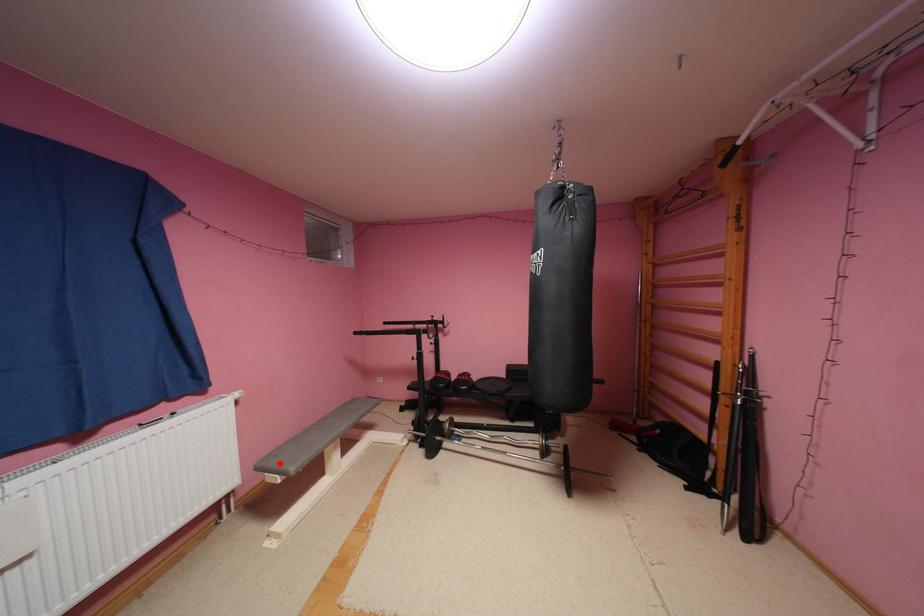
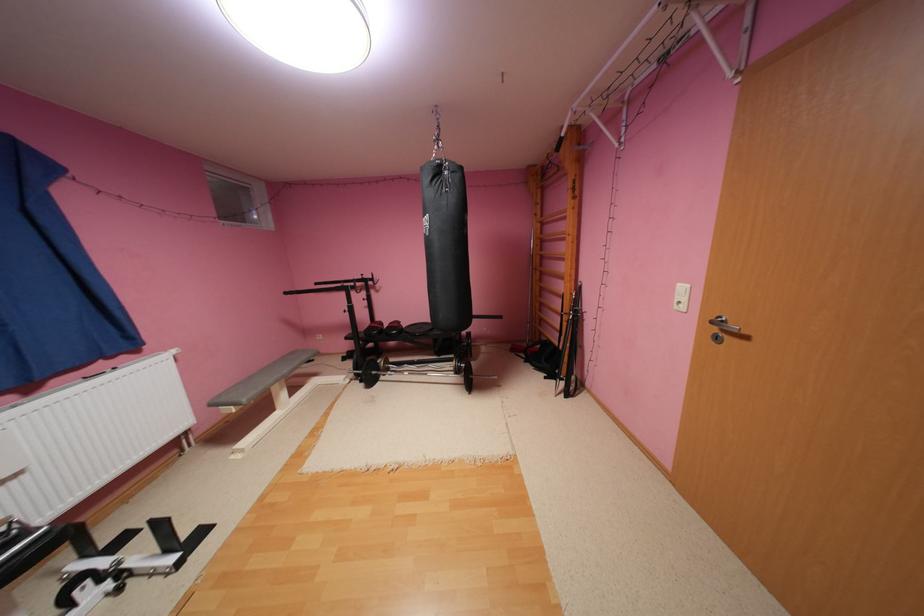
The point at the highlighted location is marked in the first image. Where is the corresponding point in the second image?

(233, 399)